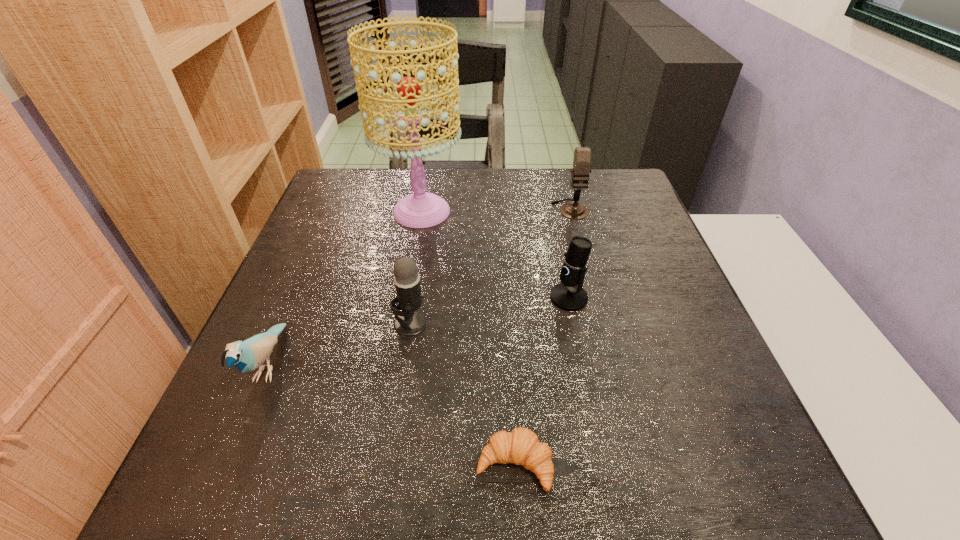
Where is `vacant area located 0.050m on the right of the shortest object`? The width and height of the screenshot is (960, 540). vacant area located 0.050m on the right of the shortest object is located at coordinates (584, 464).

The image size is (960, 540). What are the coordinates of `lampshade present at the far edge` in the screenshot? It's located at (421, 209).

Locate an element on the screen. This screenshot has width=960, height=540. microphone that is at the far edge is located at coordinates (582, 155).

At what (x,y) coordinates should I click in order to perform the action: click on object at the near edge. Please return your answer as a coordinate pair (x, y). The image size is (960, 540). Looking at the image, I should click on (521, 446).

I want to click on object that is at the left edge, so click(x=247, y=355).

You are a GUI agent. You are given a task and a screenshot of the screen. Output one action in this format:
    pyautogui.click(x=<x>, y=<y>)
    Task: Click on the object situated at the right edge
    
    Given the screenshot: What is the action you would take?
    pyautogui.click(x=582, y=155)

Find the location of `object situated at the far right corner`. object situated at the far right corner is located at coordinates (582, 155).

In the image, there is a desktop. At what (x,y) coordinates should I click in order to perform the action: click on vacant space at the far edge. Please return your answer as a coordinate pair (x, y). The image size is (960, 540). Looking at the image, I should click on (528, 204).

In the image, there is a desktop. At what (x,y) coordinates should I click in order to perform the action: click on vacant space at the left edge. Please return your answer as a coordinate pair (x, y). This screenshot has height=540, width=960. Looking at the image, I should click on (249, 374).

Where is `vacant space at the right edge of the desktop`? vacant space at the right edge of the desktop is located at coordinates (638, 329).